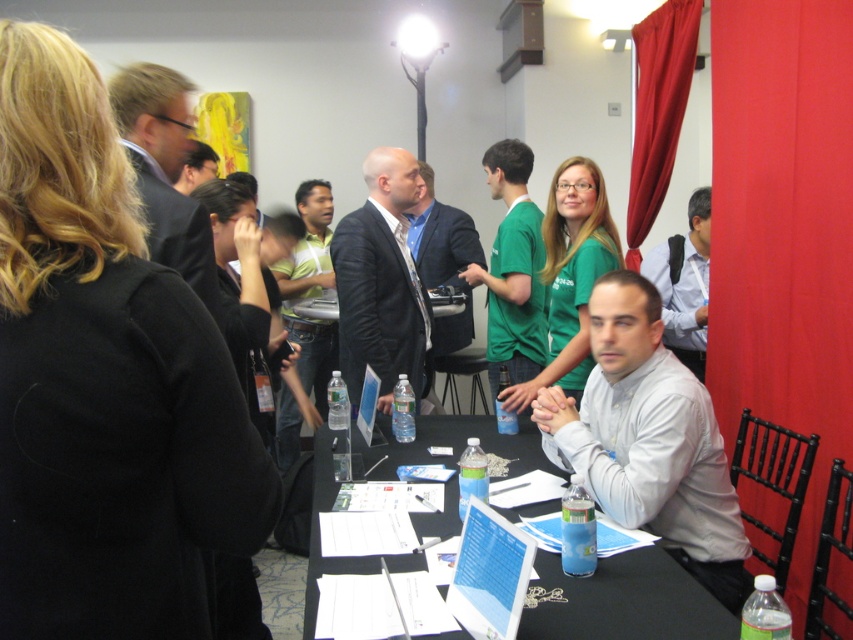
Question: Which point is closer to the camera taking this photo?

Choices:
 (A) (169, 218)
 (B) (645, 184)
 (C) (675, 294)
 (D) (392, 365)

Answer: (A)

Question: Can you confirm if red velvet curtain at upper right is smaller than white shirt at right?

Choices:
 (A) yes
 (B) no

Answer: (B)

Question: Based on their relative distances, which object is farther from the red velvet curtain at upper right?

Choices:
 (A) matte black suit at upper left
 (B) white shirt at center
 (C) black plastic table at center

Answer: (A)

Question: Can you confirm if white shirt at center is wider than matte black suit at upper left?

Choices:
 (A) yes
 (B) no

Answer: (A)

Question: Which of these objects is positioned farthest from the matte black suit at upper left?

Choices:
 (A) silver metallic laptop at center
 (B) white shirt at right
 (C) black suit at center
 (D) green fabric shirt at center

Answer: (B)

Question: Can you confirm if black suit at center is wider than red velvet curtain at upper right?

Choices:
 (A) no
 (B) yes

Answer: (B)